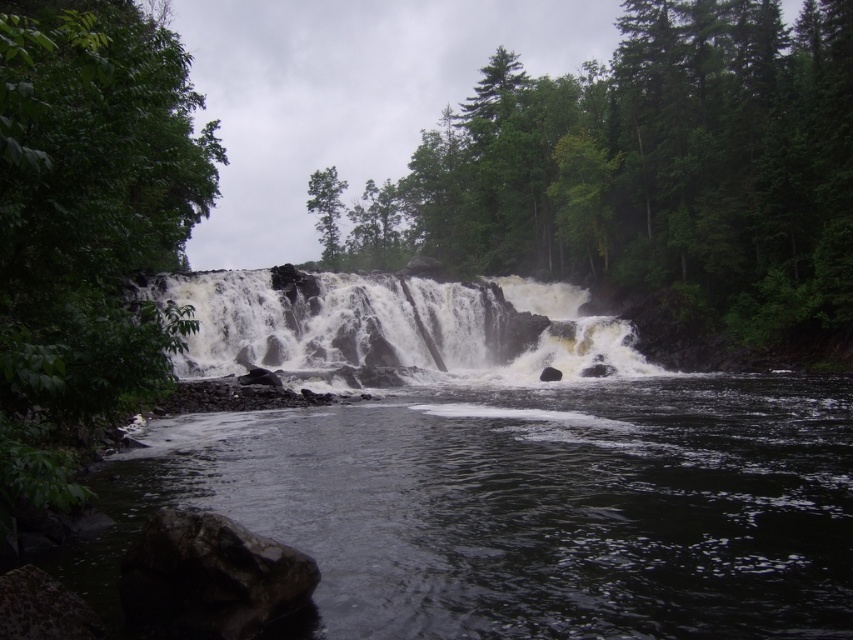
Who is higher up, green leafy tree at center or dark gray rock at lower left?

Positioned higher is green leafy tree at center.

Is green leafy tree at center wider than dark gray rock at lower left?

Yes, green leafy tree at center is wider than dark gray rock at lower left.

This screenshot has width=853, height=640. In order to click on green leafy tree at center in this screenshot , I will do `click(654, 177)`.

Consider the image. How much distance is there between green leafy tree at center and green leafy tree at left?

green leafy tree at center is 44.68 meters away from green leafy tree at left.

The width and height of the screenshot is (853, 640). Describe the element at coordinates (654, 177) in the screenshot. I see `green leafy tree at center` at that location.

Does point (802, 61) lie behind point (131, 125)?

Yes, point (802, 61) is farther from viewer.

Image resolution: width=853 pixels, height=640 pixels. What are the coordinates of `green leafy tree at center` in the screenshot? It's located at (654, 177).

Can you confirm if dark water at center is wider than green leafy tree at left?

Correct, the width of dark water at center exceeds that of green leafy tree at left.

Can you confirm if dark water at center is thinner than green leafy tree at left?

Incorrect, dark water at center's width is not less than green leafy tree at left's.

Which is behind, point (575, 612) or point (27, 193)?

The point (27, 193) is behind.

Locate an element on the screen. The width and height of the screenshot is (853, 640). dark water at center is located at coordinates (523, 508).